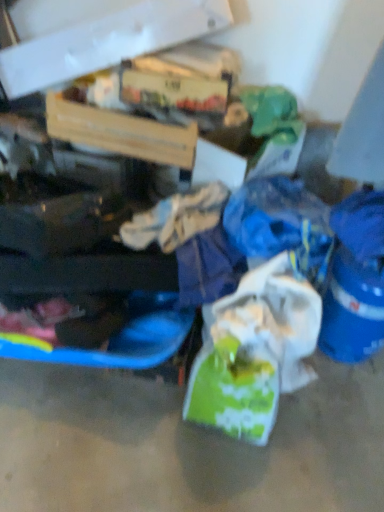
Question: From a real-world perspective, is blue plastic bucket at lower right above or below cardboard box at upper left, acting as the first box starting from the top?

Choices:
 (A) above
 (B) below

Answer: (B)

Question: Considering the positions of blue plastic bucket at lower right and cardboard box at upper left, arranged as the second box when ordered from the bottom, in the image, is blue plastic bucket at lower right taller or shorter than cardboard box at upper left, arranged as the second box when ordered from the bottom,?

Choices:
 (A) tall
 (B) short

Answer: (A)

Question: Which object is positioned closest to the blue plastic bucket at lower right?

Choices:
 (A) white matte plastic bag at center
 (B) cardboard box at upper left, acting as the first box starting from the top
 (C) wooden crate at upper center, which is the 1th box from bottom to top

Answer: (A)

Question: Estimate the real-world distances between objects in this image. Which object is closer to the blue plastic bucket at lower right?

Choices:
 (A) white matte plastic bag at center
 (B) cardboard box at upper left, arranged as the second box when ordered from the bottom
 (C) wooden crate at upper center, which is the 1th box from bottom to top

Answer: (A)